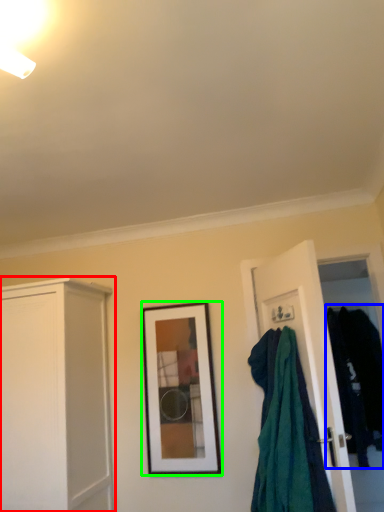
Question: Based on their relative distances, which object is farther from cabinetry (highlighted by a red box)? Choose from clothing (highlighted by a blue box) and picture frame (highlighted by a green box).

Choices:
 (A) clothing
 (B) picture frame

Answer: (A)